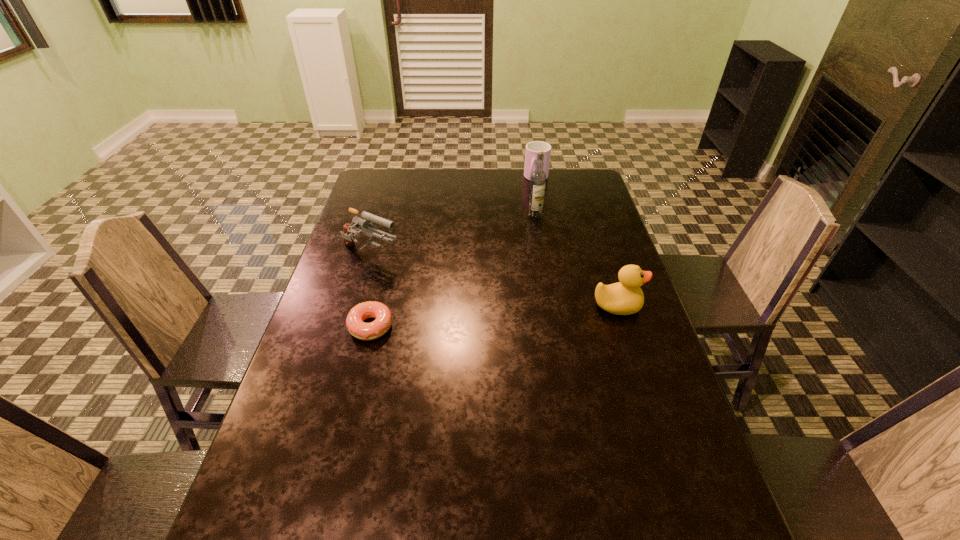
Where is `free space on the desktop that is between the doughnut and the rightmost object and is positioned on the label of the fourth nearest object`? free space on the desktop that is between the doughnut and the rightmost object and is positioned on the label of the fourth nearest object is located at coordinates (461, 319).

Identify the location of free space on the desktop that is between the doughnut and the duck and is positioned at the barrel end of the gun. This screenshot has height=540, width=960. (515, 314).

At what (x,y) coordinates should I click in order to perform the action: click on vacant space on the desktop that is between the doughnut and the duck and is positioned with the handle on the side of the farthest object. Please return your answer as a coordinate pair (x, y). Looking at the image, I should click on tap(462, 319).